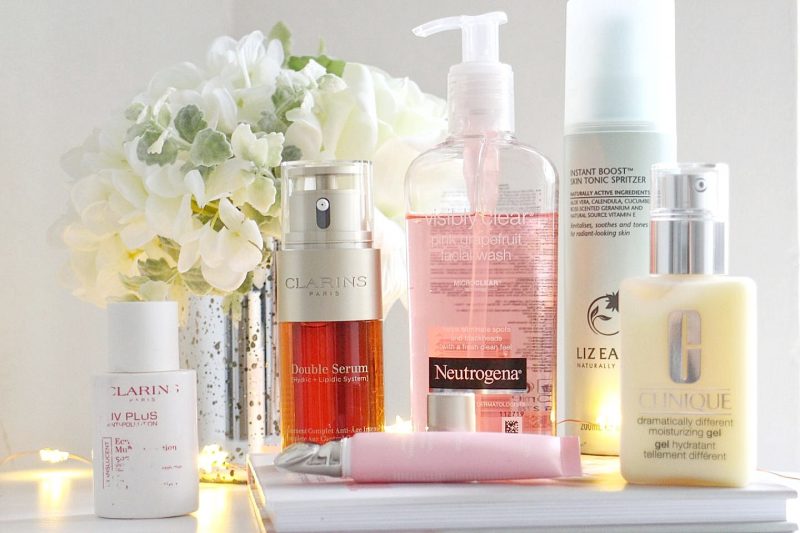
The height and width of the screenshot is (533, 800). Find the location of `bottles`. bottles is located at coordinates [149, 449], [324, 254], [462, 193], [602, 167], [694, 254].